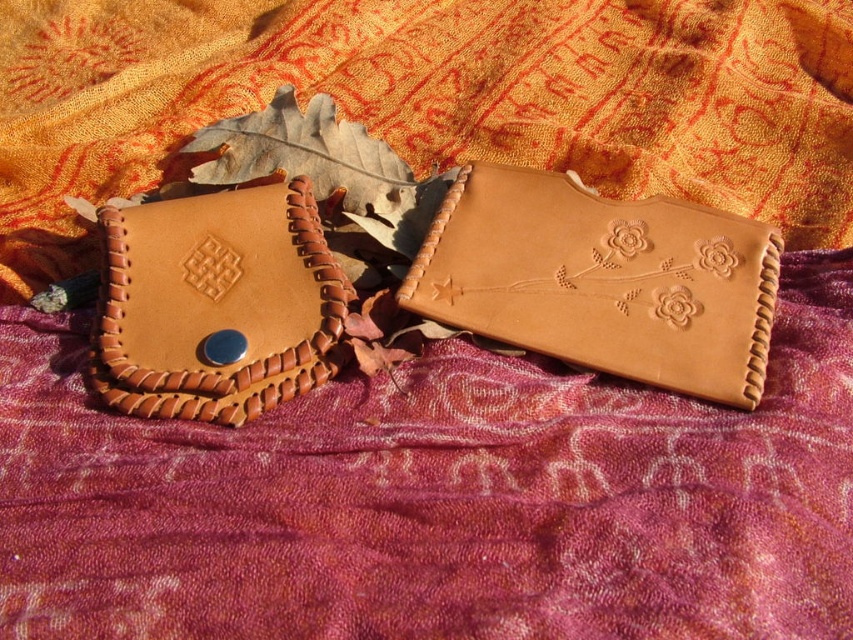
Which of these two, tan leather wallet at center or matte brown leather wallet at left, stands shorter?

Standing shorter between the two is matte brown leather wallet at left.

Can you confirm if tan leather wallet at center is wider than matte brown leather wallet at left?

Correct, the width of tan leather wallet at center exceeds that of matte brown leather wallet at left.

The height and width of the screenshot is (640, 853). Find the location of `tan leather wallet at center`. tan leather wallet at center is located at coordinates (602, 280).